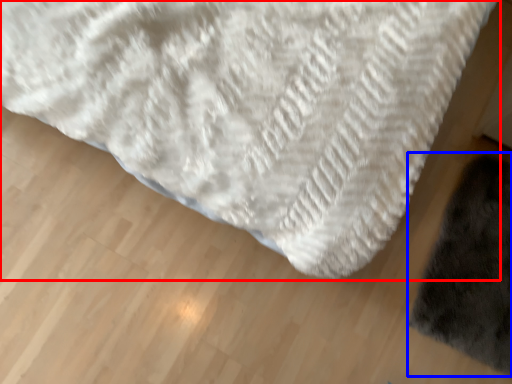
Question: Which object is further to the camera taking this photo, towel (highlighted by a red box) or mat (highlighted by a blue box)?

Choices:
 (A) towel
 (B) mat

Answer: (B)